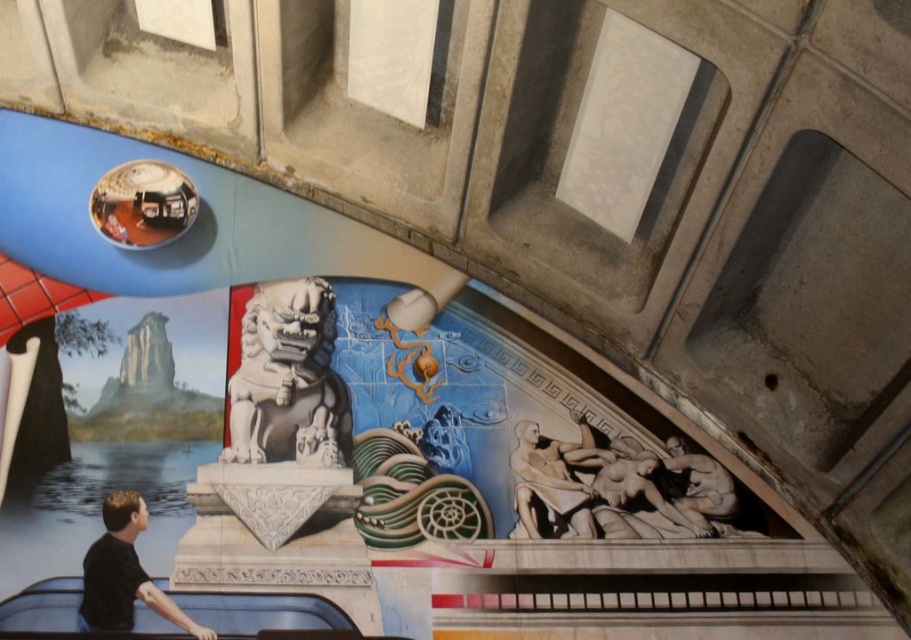
Does black matte shirt at lower left have a lesser width compared to beige marble statue at lower right?

No, black matte shirt at lower left is not thinner than beige marble statue at lower right.

Who is positioned more to the right, black matte shirt at lower left or beige marble statue at lower right?

From the viewer's perspective, beige marble statue at lower right appears more on the right side.

Image resolution: width=911 pixels, height=640 pixels. I want to click on black matte shirt at lower left, so click(x=123, y=573).

From the picture: How much distance is there between white stone lion at center and beige marble statue at lower right?

The distance of white stone lion at center from beige marble statue at lower right is 6.67 feet.

Measure the distance between point (258, 451) and camera.

7.83 meters

Identify the location of white stone lion at center. tap(288, 380).

Identify the location of white stone lion at center. This screenshot has width=911, height=640. (288, 380).

Who is lower down, beige marble statue at lower right or smooth stone statue at lower right?

smooth stone statue at lower right is below.

Is beige marble statue at lower right to the right of smooth stone statue at lower right from the viewer's perspective?

A: No, beige marble statue at lower right is not to the right of smooth stone statue at lower right.

What do you see at coordinates (554, 481) in the screenshot? This screenshot has height=640, width=911. I see `beige marble statue at lower right` at bounding box center [554, 481].

At what (x,y) coordinates should I click in order to perform the action: click on beige marble statue at lower right. Please return your answer as a coordinate pair (x, y). This screenshot has height=640, width=911. Looking at the image, I should click on (554, 481).